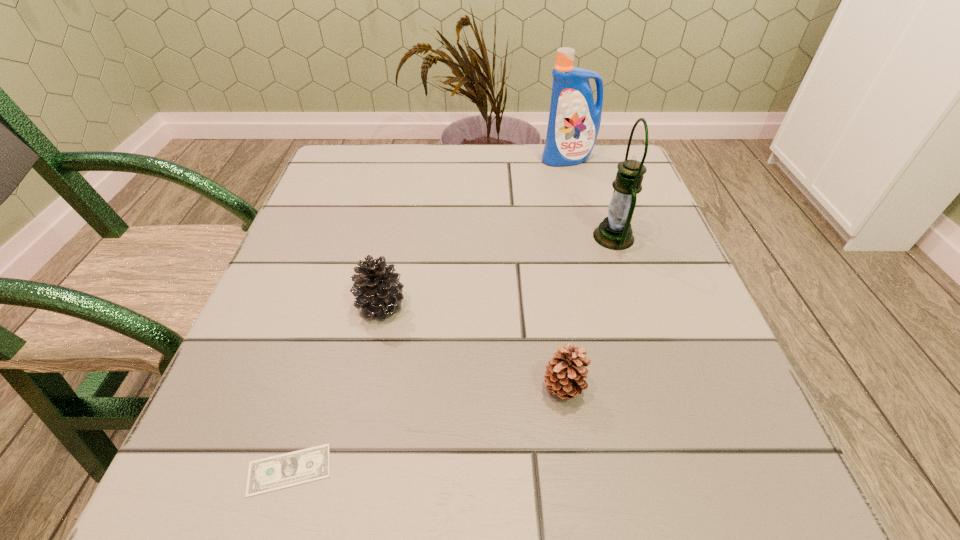
The height and width of the screenshot is (540, 960). Find the location of `object located at the near left corner`. object located at the near left corner is located at coordinates (273, 473).

You are a GUI agent. You are given a task and a screenshot of the screen. Output one action in this format:
    pyautogui.click(x=<x>, y=<y>)
    Task: Click on the object at the far right corner
    This screenshot has width=960, height=540.
    Given the screenshot: What is the action you would take?
    pyautogui.click(x=574, y=121)

What are the coordinates of `free space at the far edge of the desktop` in the screenshot? It's located at (431, 172).

Where is `vacant space at the near edge of the desktop`? vacant space at the near edge of the desktop is located at coordinates (412, 441).

What are the coordinates of `vacant point at the left edge` in the screenshot? It's located at (246, 327).

At what (x,y) coordinates should I click in order to perform the action: click on free point at the right edge. Please return your answer as a coordinate pair (x, y). The width and height of the screenshot is (960, 540). Looking at the image, I should click on (692, 428).

Locate an element on the screen. Image resolution: width=960 pixels, height=540 pixels. vacant space at the far left corner of the desktop is located at coordinates (357, 191).

In the image, there is a desktop. Where is `free space at the near left corner`? The height and width of the screenshot is (540, 960). free space at the near left corner is located at coordinates click(x=275, y=493).

At what (x,y) coordinates should I click in order to perform the action: click on vacant space at the far right corner of the desktop. Please return your answer as a coordinate pair (x, y). The height and width of the screenshot is (540, 960). Looking at the image, I should click on (594, 159).

The image size is (960, 540). In order to click on vacant space at the near right corner of the desktop in this screenshot , I will do `click(764, 478)`.